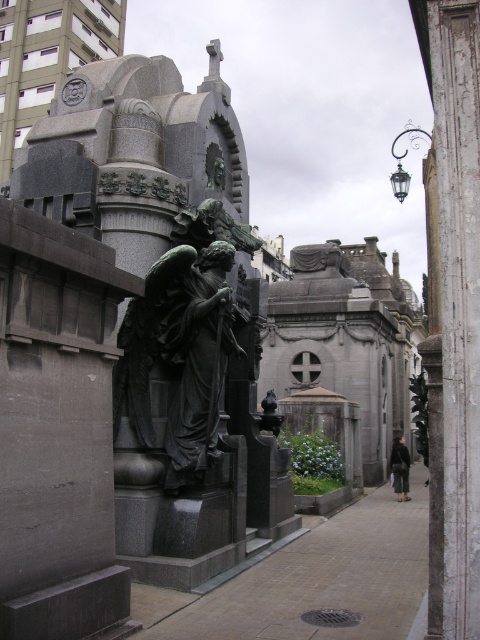
Question: Which object is closer to the camera taking this photo?

Choices:
 (A) bronze statue at center
 (B) smooth concrete pavement at center

Answer: (B)

Question: Is smooth concrete pavement at center above bronze statue at center?

Choices:
 (A) no
 (B) yes

Answer: (A)

Question: Which object appears farthest from the camera in this image?

Choices:
 (A) bronze statue at center
 (B) smooth concrete pavement at center

Answer: (A)

Question: Which object appears closest to the camera in this image?

Choices:
 (A) smooth concrete pavement at center
 (B) bronze statue at center

Answer: (A)

Question: Does smooth concrete pavement at center appear under bronze statue at center?

Choices:
 (A) no
 (B) yes

Answer: (B)

Question: Can you confirm if smooth concrete pavement at center is positioned to the left of bronze statue at center?

Choices:
 (A) no
 (B) yes

Answer: (A)